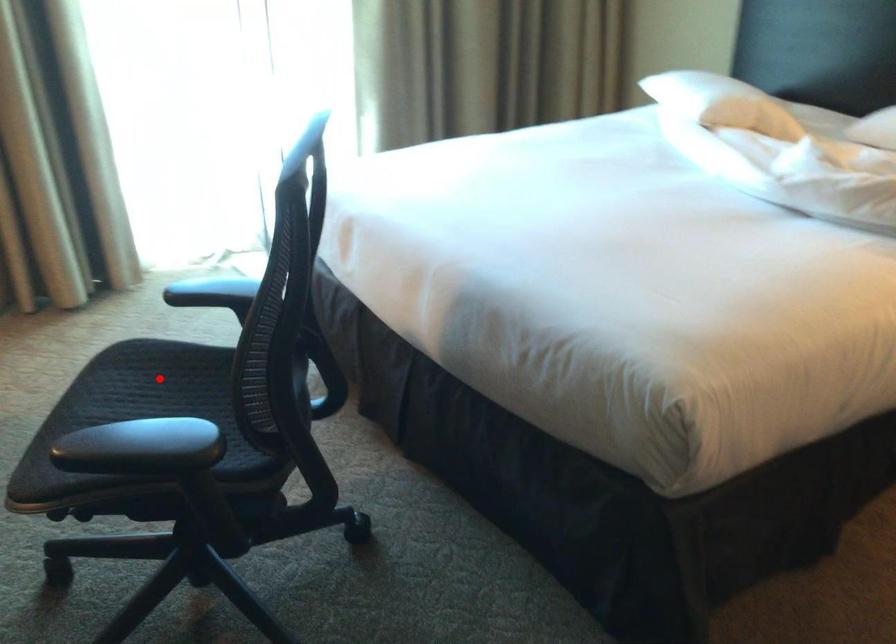
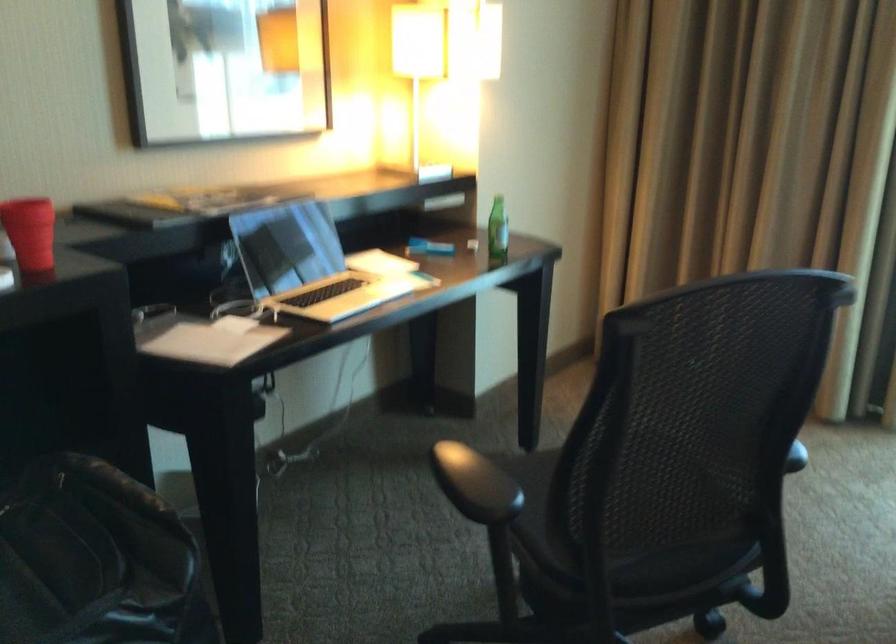
Question: I am providing you with two images of the same scene from different viewpoints. A red point is marked on the first image. At the location where the point appears in image 1, is it still visible in image 2?

Choices:
 (A) Yes
 (B) No

Answer: (B)